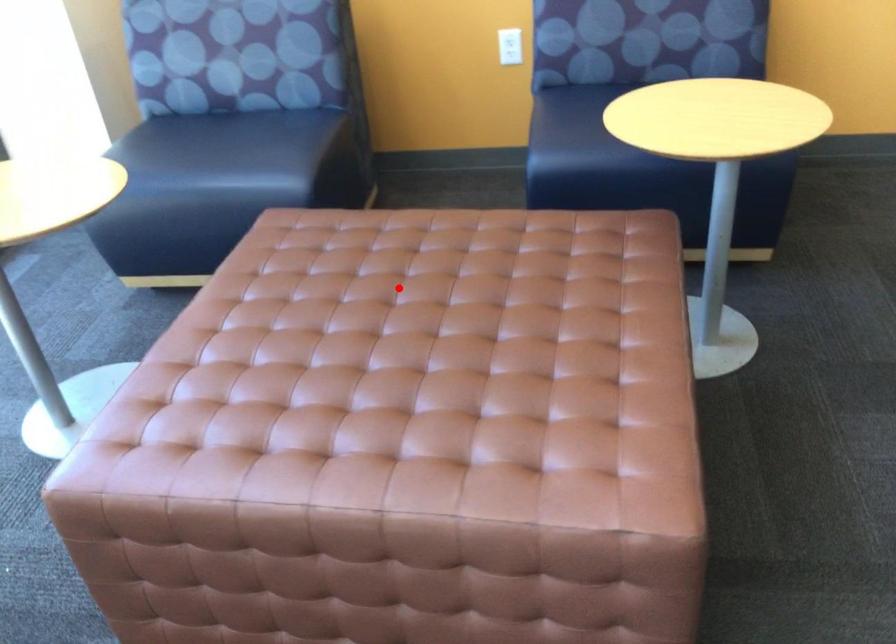
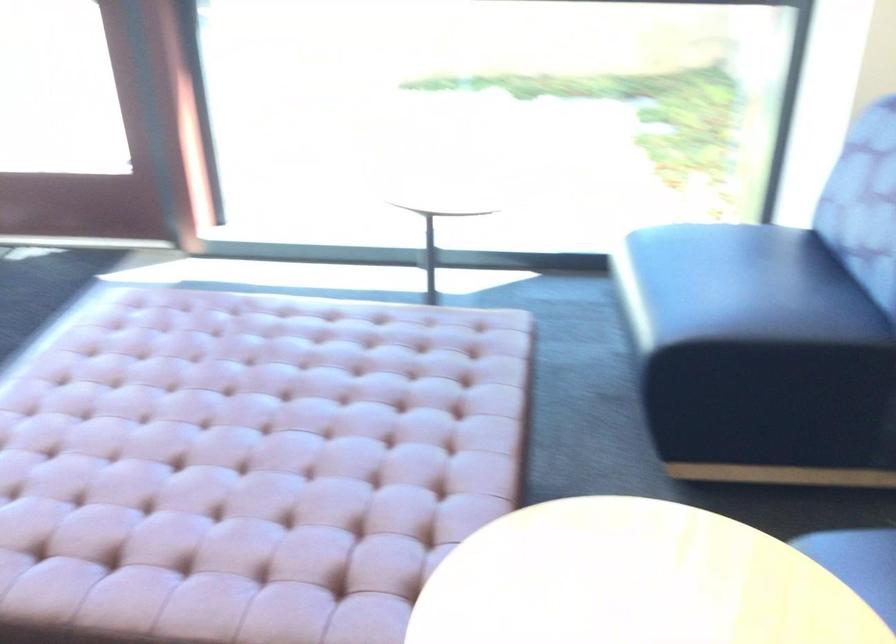
Question: I am providing you with two images of the same scene from different viewpoints. Given a red point in image1, look at the same physical point in image2. Is it:

Choices:
 (A) Closer to the viewpoint
 (B) Farther from the viewpoint

Answer: (A)